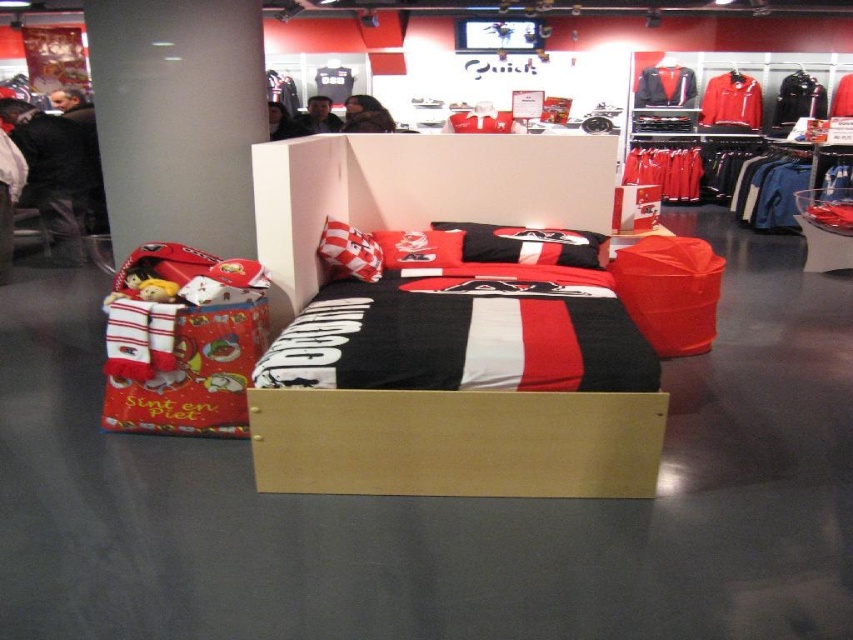
You are shopping for a gift and see the black cotton shirt at left and the black leather jacket at center. Which item is positioned more to the left side of the store section?

The black cotton shirt at left is positioned more to the left side of the store section than the black leather jacket at center.